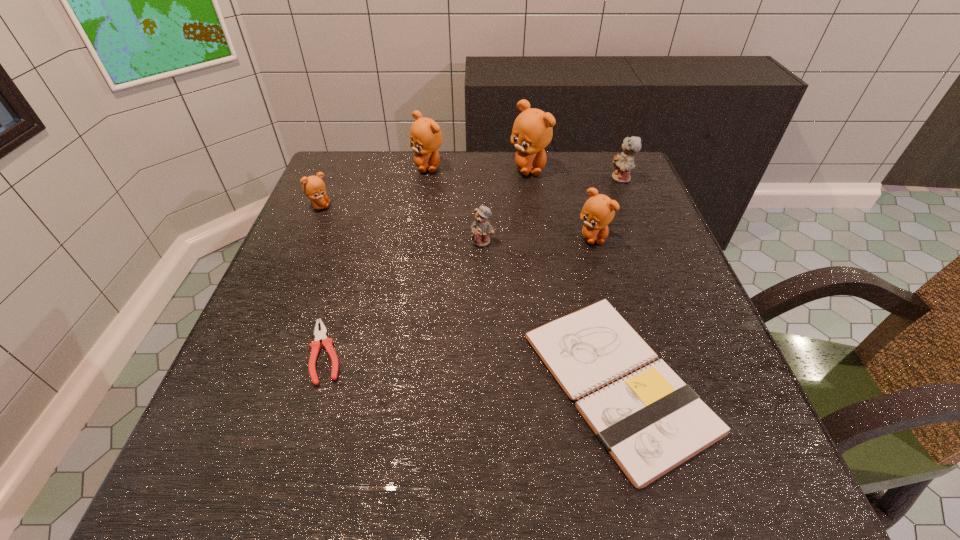
At what (x,y) coordinates should I click in order to perform the action: click on free point located 0.280m on the face of the second teddy bear from right to left. Please return your answer as a coordinate pair (x, y). This screenshot has width=960, height=540. Looking at the image, I should click on (625, 354).

Locate an element on the screen. Image resolution: width=960 pixels, height=540 pixels. vacant region located 0.220m on the face of the leftmost object is located at coordinates (421, 206).

The image size is (960, 540). I want to click on free space located on the front-facing side of the fourth object from left to right, so click(483, 267).

This screenshot has height=540, width=960. I want to click on vacant region located on the back of the notepad, so click(x=591, y=278).

Locate an element on the screen. This screenshot has width=960, height=540. blank space located 0.110m on the back of the pliers is located at coordinates (348, 279).

I want to click on object that is at the near edge, so click(x=650, y=422).

The height and width of the screenshot is (540, 960). Identify the location of teddy bear at the left edge. (314, 188).

This screenshot has height=540, width=960. I want to click on pliers that is positioned at the left edge, so 315,346.

Where is `notepad present at the right edge`? This screenshot has width=960, height=540. notepad present at the right edge is located at coordinates (650, 422).

Locate an element on the screen. This screenshot has height=540, width=960. object at the far left corner is located at coordinates (314, 188).